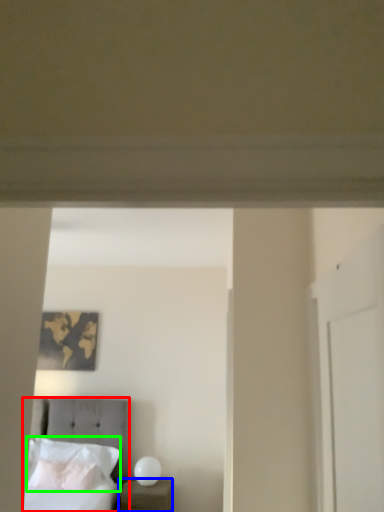
Question: Considering the real-world distances, which object is closest to bed (highlighted by a red box)? nightstand (highlighted by a blue box) or pillow (highlighted by a green box).

Choices:
 (A) nightstand
 (B) pillow

Answer: (B)